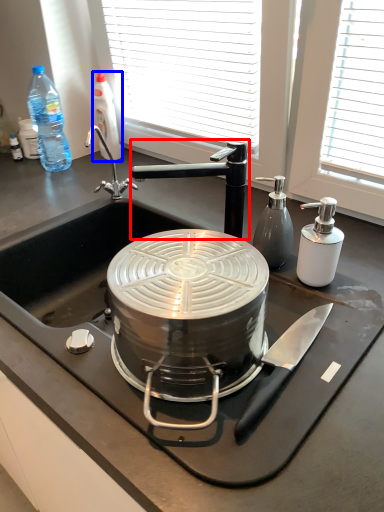
Question: Which point is further to the camera, tap (highlighted by a red box) or bottle (highlighted by a blue box)?

Choices:
 (A) tap
 (B) bottle

Answer: (B)